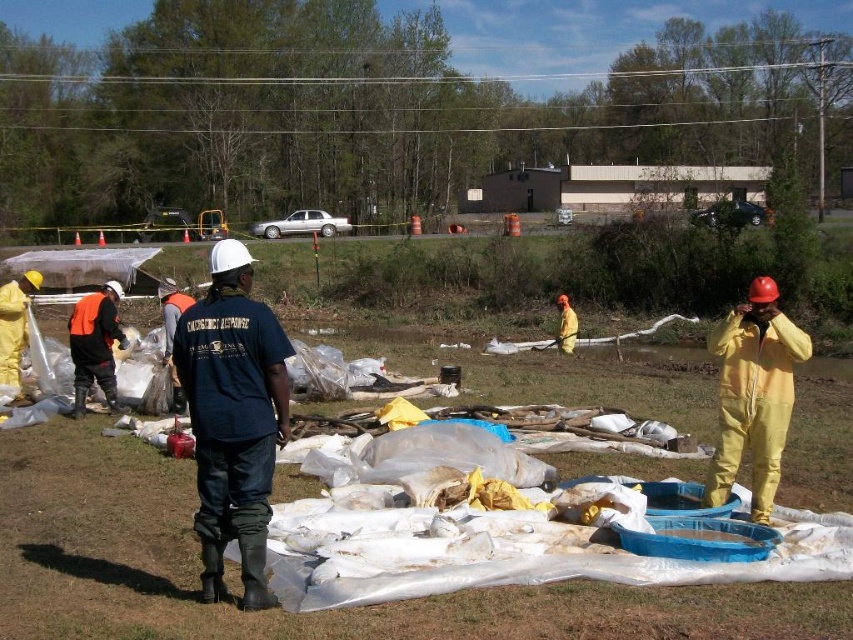
Question: Which object appears closest to the camera in this image?

Choices:
 (A) black matte shirt at center
 (B) yellow rubber boots at center
 (C) yellow matte suit at right

Answer: (B)

Question: Is yellow rubber boots at center positioned before yellow matte suit at right?

Choices:
 (A) no
 (B) yes

Answer: (B)

Question: Does yellow rubber boots at center lie in front of black matte shirt at center?

Choices:
 (A) no
 (B) yes

Answer: (B)

Question: Does yellow rubber boots at center have a lesser width compared to black matte shirt at center?

Choices:
 (A) no
 (B) yes

Answer: (A)

Question: Which object is positioned closest to the yellow rubber boots at center?

Choices:
 (A) black matte shirt at center
 (B) yellow matte suit at right

Answer: (B)

Question: Which point appears closest to the camera in this image?

Choices:
 (A) (222, 572)
 (B) (776, 326)
 (C) (561, 634)

Answer: (C)